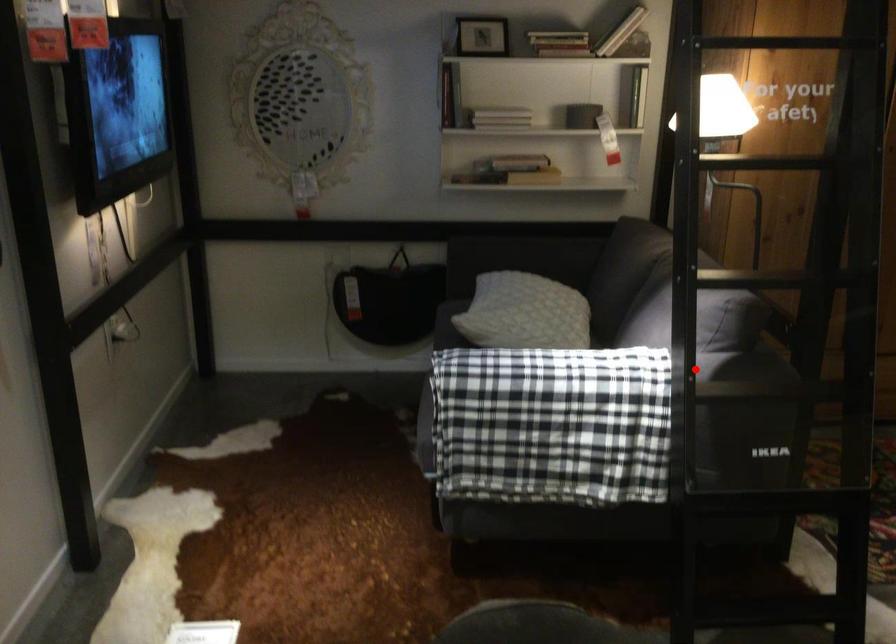
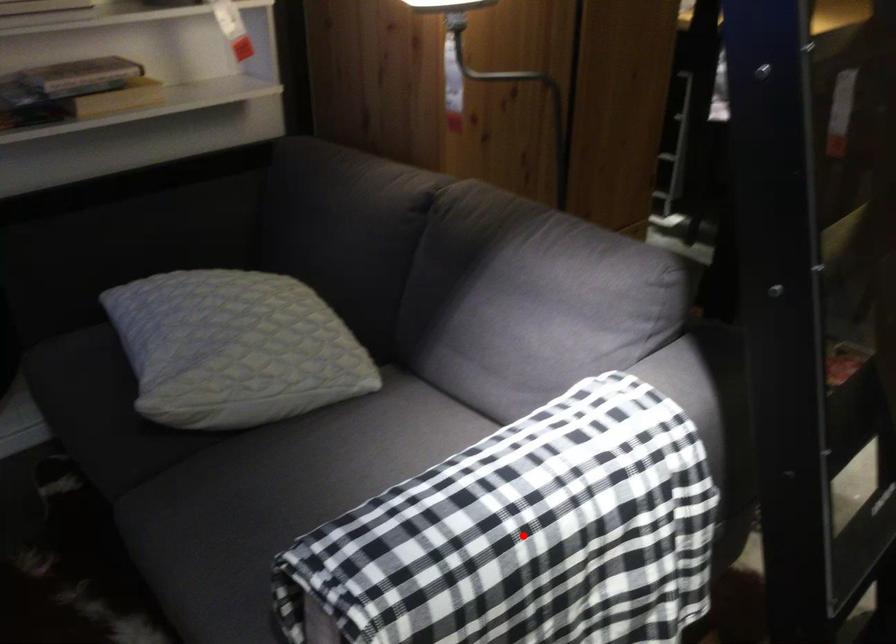
I am providing you with two images of the same scene from different viewpoints. A red point is marked on the first image and another point is marked on the second image. Is the red point in image1 aligned with the point shown in image2?

No